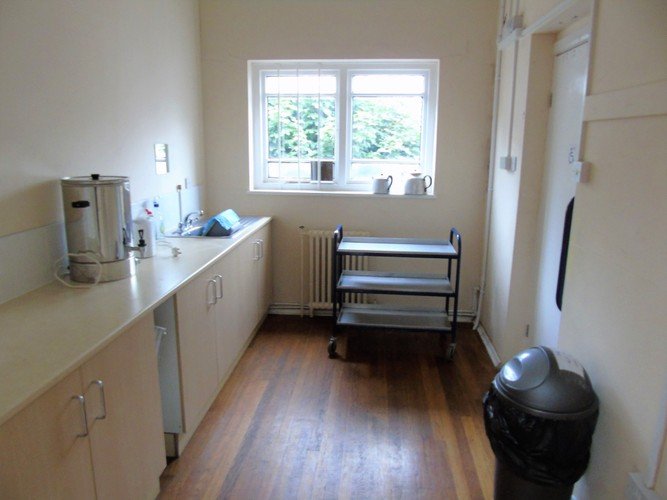
I want to click on dispenser, so click(141, 248), click(139, 235).